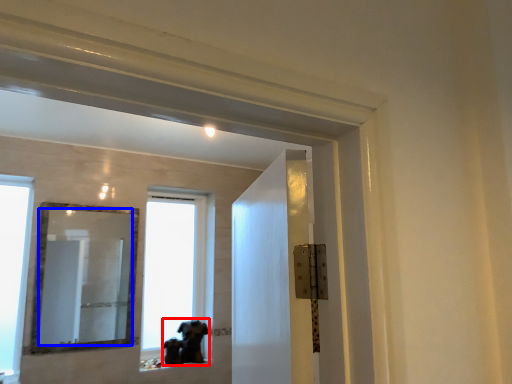
Question: Which of the following is the farthest to the observer, animal (highlighted by a red box) or mirror (highlighted by a blue box)?

Choices:
 (A) animal
 (B) mirror

Answer: (A)